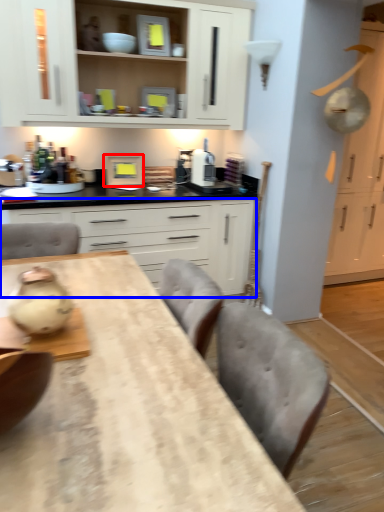
Question: Which of the following is the closest to the observer, appliance (highlighted by a red box) or cabinetry (highlighted by a blue box)?

Choices:
 (A) appliance
 (B) cabinetry

Answer: (B)